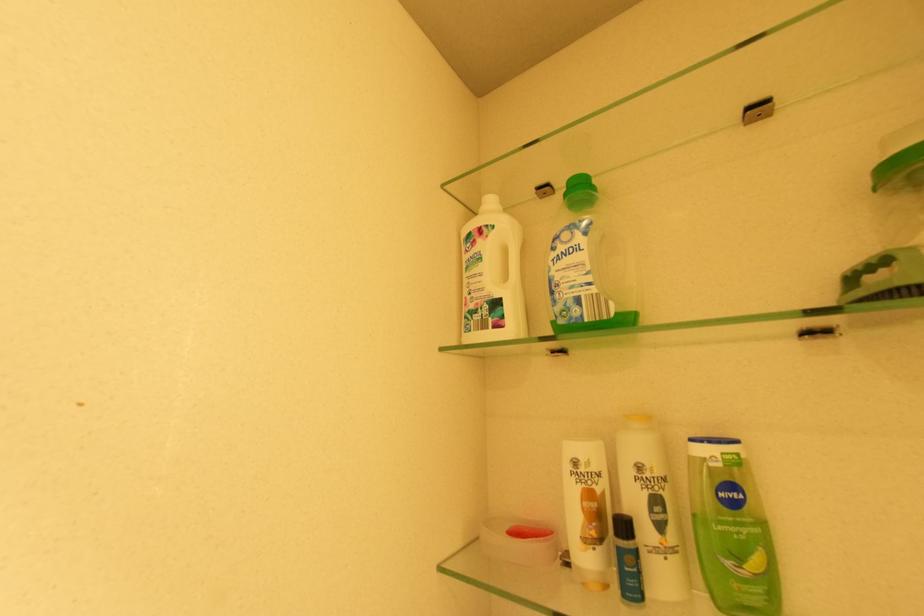
What do you see at coordinates (513, 257) in the screenshot? The height and width of the screenshot is (616, 924). I see `the white bottle handle` at bounding box center [513, 257].